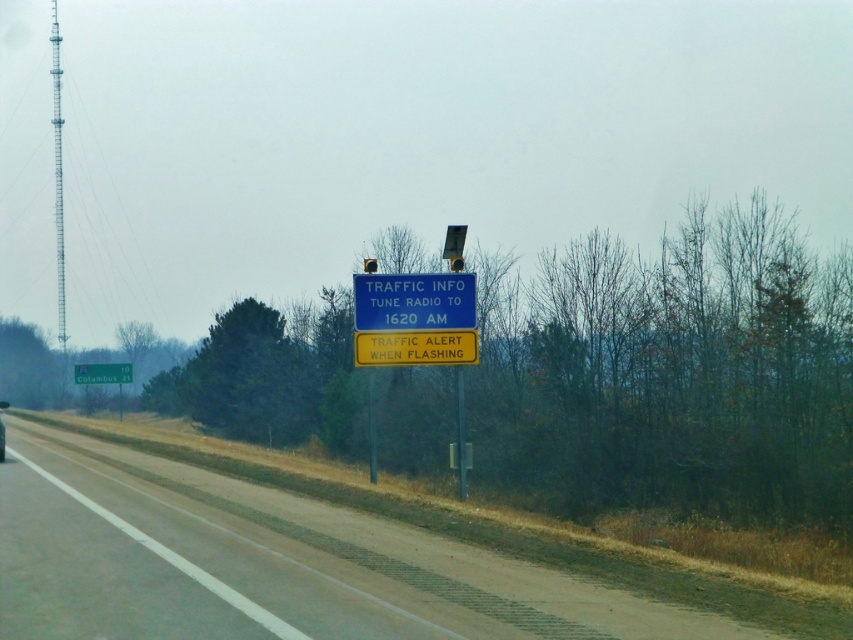
Question: Which object appears closest to the camera in this image?

Choices:
 (A) yellow plastic traffic sign at center
 (B) blue plastic traffic sign at center
 (C) shiny black car at center
 (D) gray asphalt road at center

Answer: (D)

Question: Which object is the closest to the yellow plastic traffic sign at center?

Choices:
 (A) gray asphalt road at center
 (B) shiny black car at center
 (C) metallic pole at center
 (D) blue plastic traffic sign at center

Answer: (D)

Question: Considering the relative positions of gray asphalt road at center and blue plastic traffic sign at center in the image provided, where is gray asphalt road at center located with respect to blue plastic traffic sign at center?

Choices:
 (A) below
 (B) above

Answer: (A)

Question: Is gray asphalt road at center above yellow plastic traffic sign at center?

Choices:
 (A) yes
 (B) no

Answer: (B)

Question: Can you confirm if gray asphalt road at center is wider than shiny black car at center?

Choices:
 (A) yes
 (B) no

Answer: (B)

Question: Which point is closer to the camera?

Choices:
 (A) blue plastic traffic sign at center
 (B) yellow plastic sign at center
 (C) metallic pole at center
 (D) gray asphalt road at center

Answer: (D)